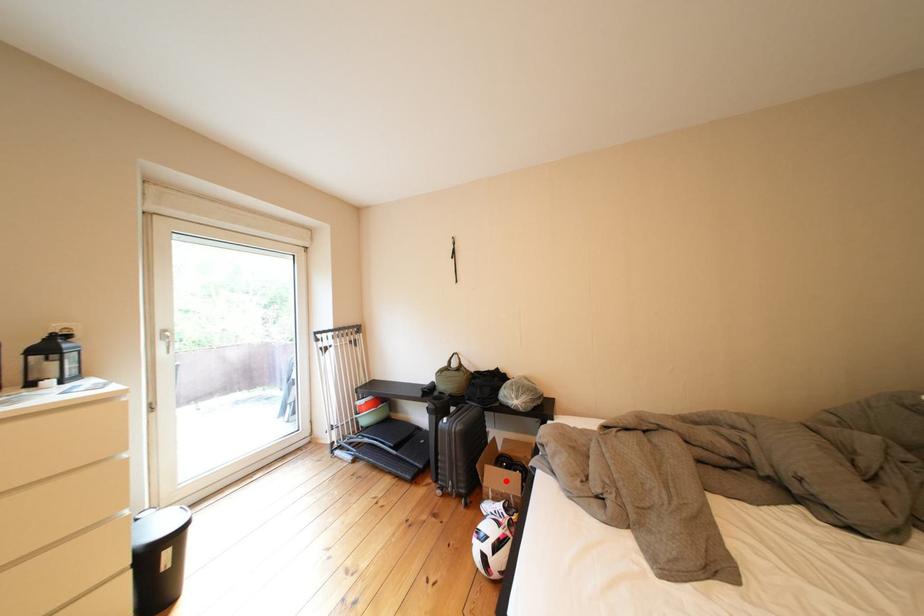
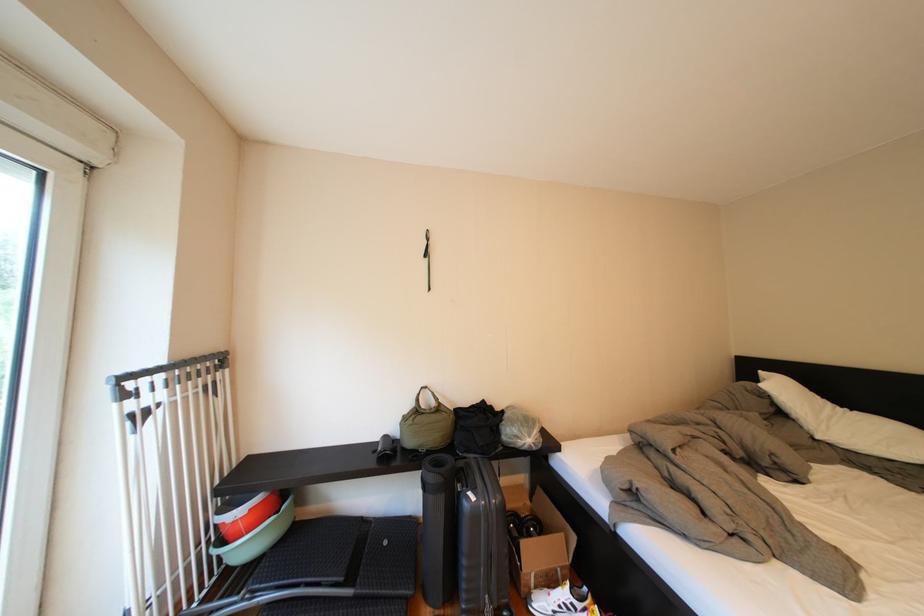
Where in the second image is the point corresponding to the highlighted location from the first image?

(544, 557)